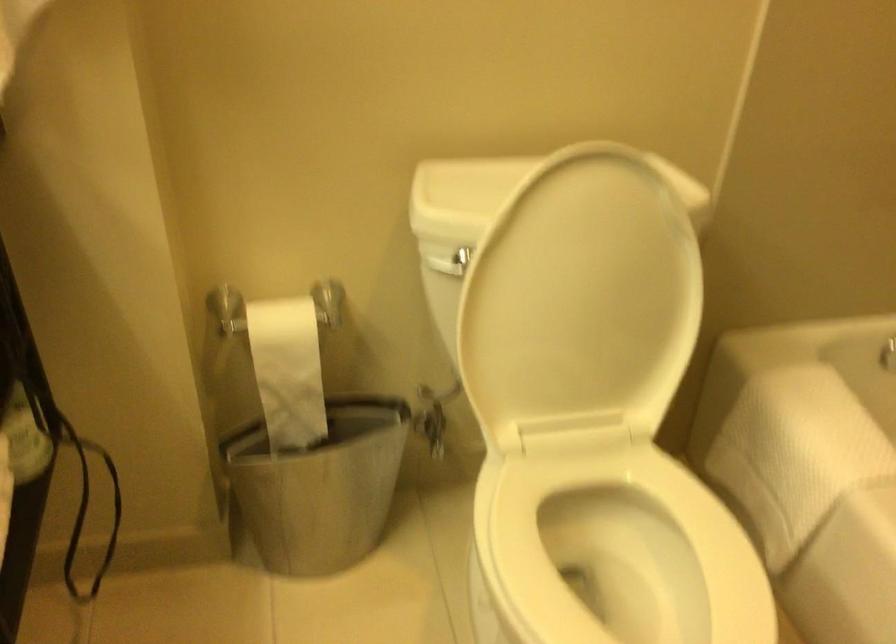
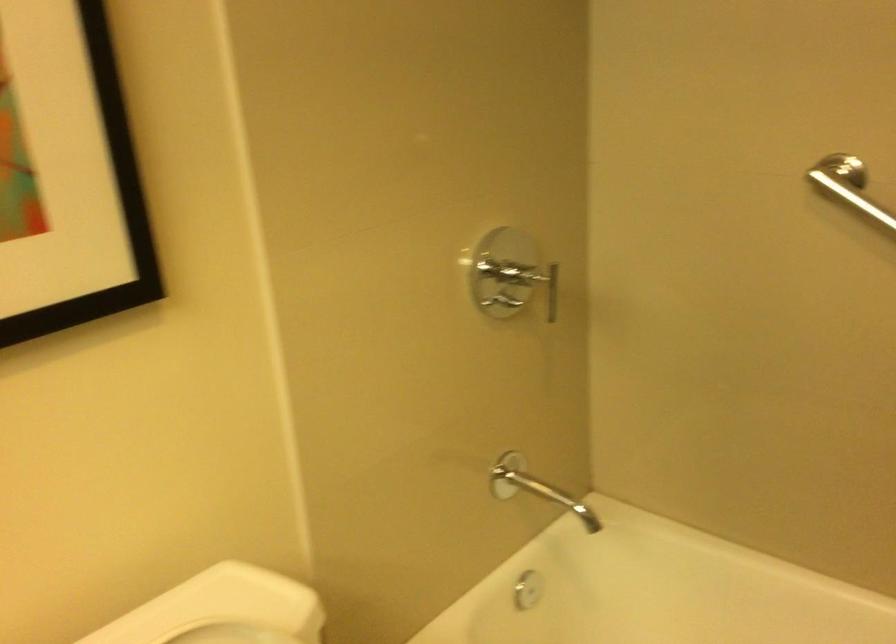
Question: The first image is from the beginning of the video and the second image is from the end. How did the camera likely rotate when shooting the video?

Choices:
 (A) Left
 (B) Right
 (C) Up
 (D) Down

Answer: (B)